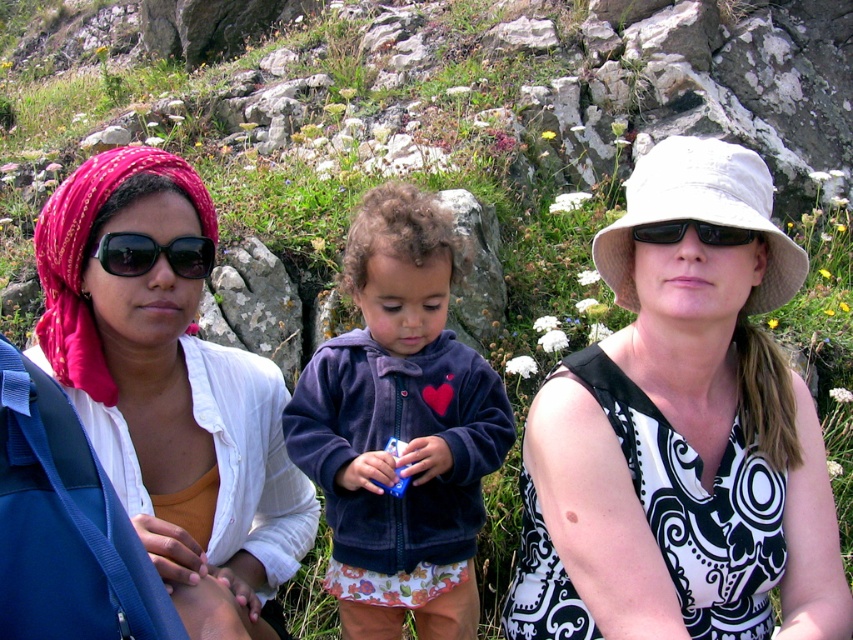
You are a photographer trying to capture a group photo of the two people in the scene. You need to ensure that both the matte pink headscarf at left and the black plastic sunglasses at right are visible in the frame. Based on their positions, which object should you focus on first to ensure both are in the shot?

The matte pink headscarf at left is below the black plastic sunglasses at right. To ensure both are visible, focus on the black plastic sunglasses at right first since it is higher up, allowing the lower positioned matte pink headscarf at left to naturally fall into the frame.

Based on the coordinates provided, which object is located at point (399, 428) in the image?

The point (399, 428) marks the location of the velvet purple jacket at center.